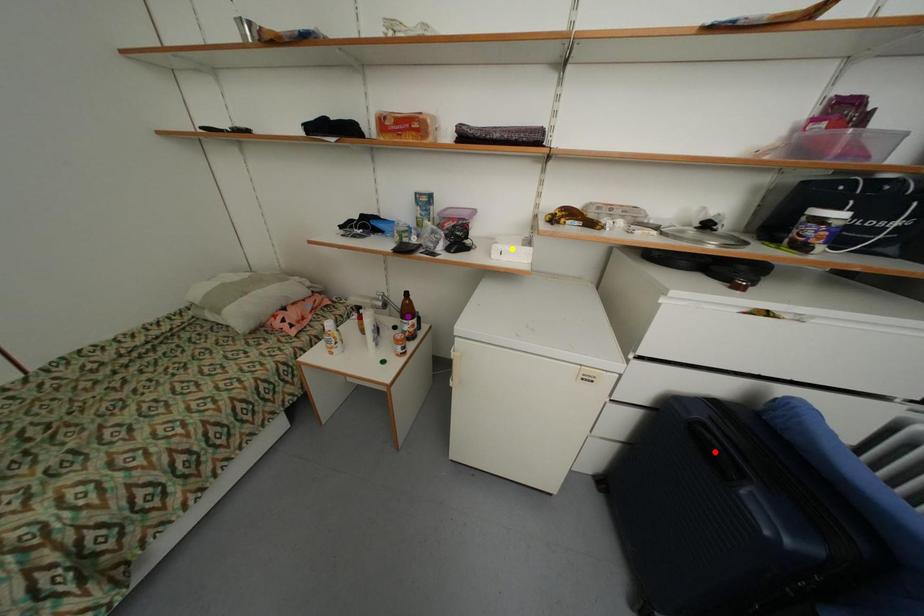
Order these from nearest to farthest:
1. yellow point
2. purple point
3. red point

red point → yellow point → purple point